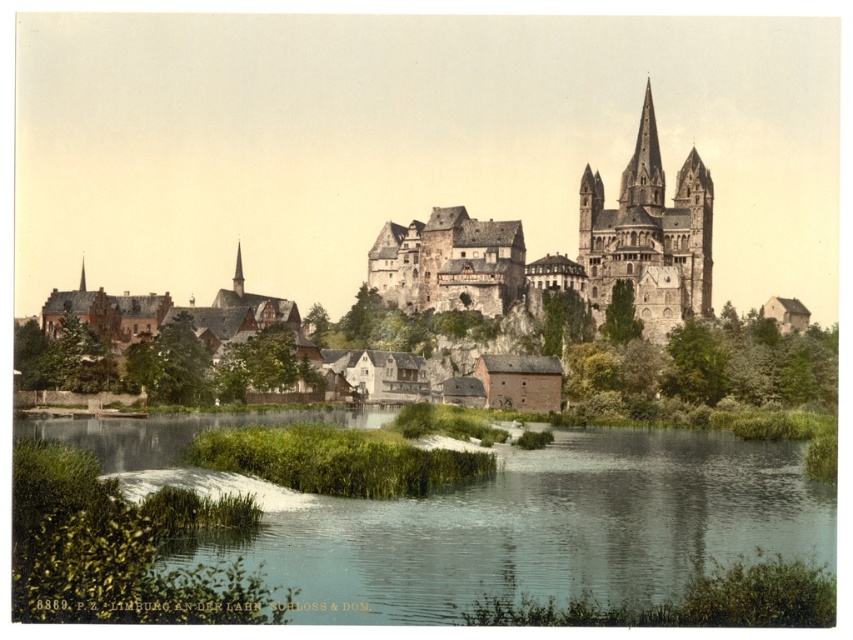
Is green grassy river at lower center behind smooth stone spire at upper center?

That is False.

Between green grassy river at lower center and smooth stone spire at upper center, which one has less height?

With less height is green grassy river at lower center.

Between point (450, 557) and point (657, 173), which one is positioned behind?

Point (657, 173)

Identify the location of green grassy river at lower center. (494, 516).

Is green grassy river at lower center taller than smooth gray steeple at upper left?

Incorrect, green grassy river at lower center's height is not larger of smooth gray steeple at upper left's.

Is point (408, 541) positioned behind point (241, 280)?

No, (408, 541) is in front of (241, 280).

Image resolution: width=853 pixels, height=640 pixels. Identify the location of green grassy river at lower center. (494, 516).

Does point (425, 289) come closer to viewer compared to point (648, 124)?

Yes.

Which is in front, point (657, 292) or point (699, 276)?

Point (657, 292) is more forward.

You are a GUI agent. You are given a task and a screenshot of the screen. Output one action in this format:
    pyautogui.click(x=<x>, y=<y>)
    Task: Click on the brown stone castle at center
    This screenshot has width=853, height=640.
    Given the screenshot: What is the action you would take?
    pyautogui.click(x=564, y=256)